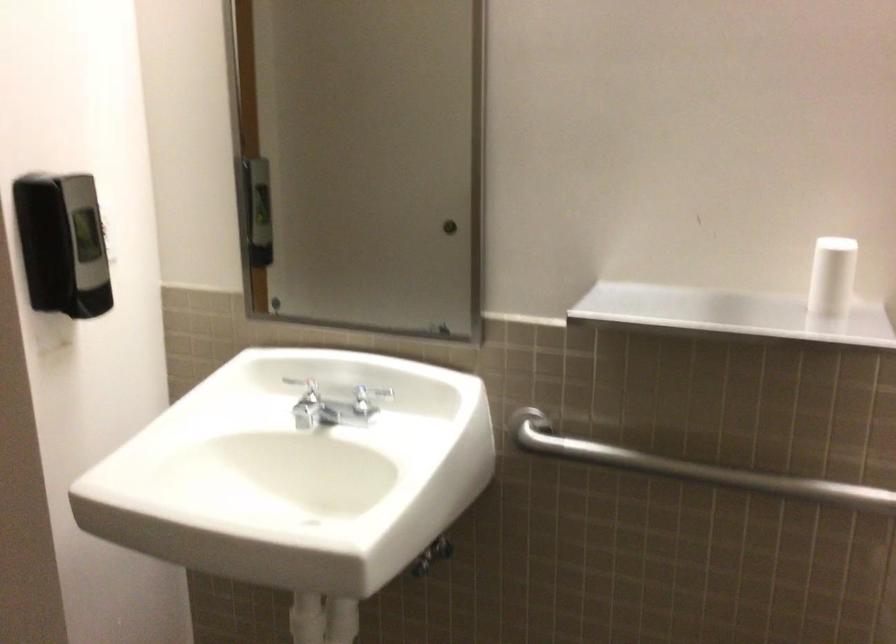
The height and width of the screenshot is (644, 896). I want to click on drain plug lever, so click(x=325, y=623).